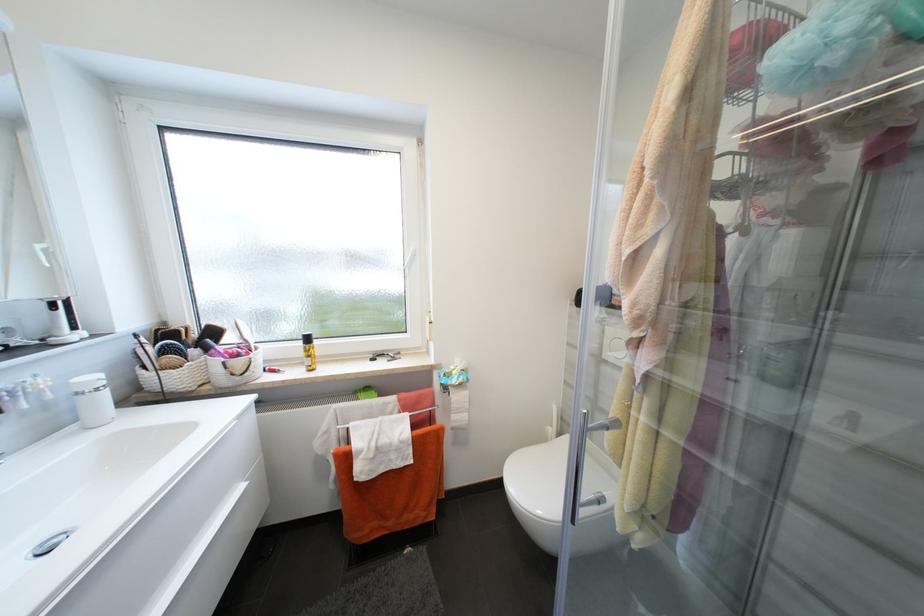
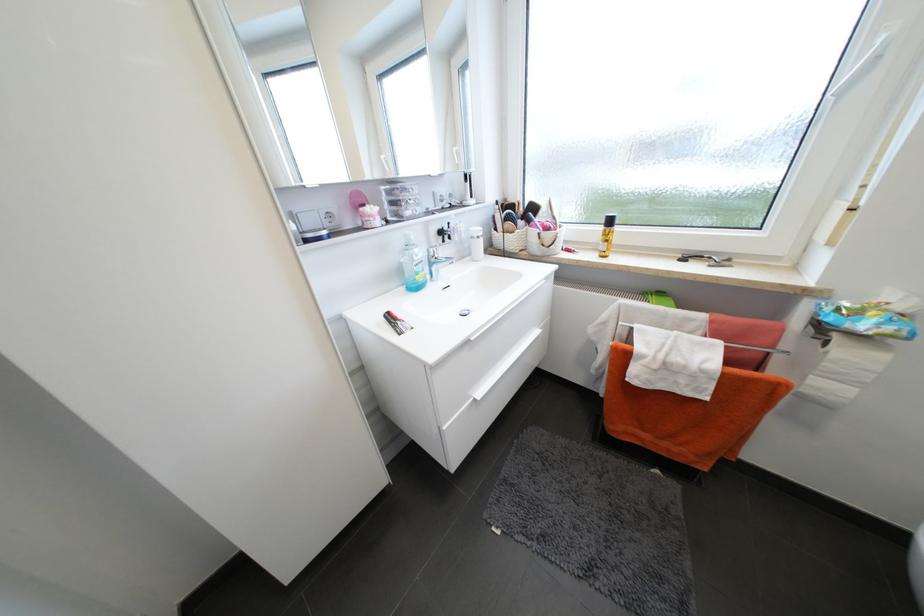
Locate, in the second image, the point that corresponds to point (83, 395) in the first image.

(478, 238)